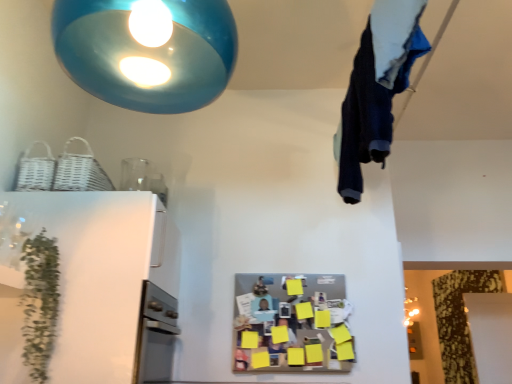
Question: Is white glossy refrigerator at left to the left of green leafy plant at left from the viewer's perspective?

Choices:
 (A) no
 (B) yes

Answer: (A)

Question: Is the surface of white glossy refrigerator at left in direct contact with green leafy plant at left?

Choices:
 (A) yes
 (B) no

Answer: (A)

Question: Would you consider white glossy refrigerator at left to be distant from green leafy plant at left?

Choices:
 (A) yes
 (B) no

Answer: (B)

Question: Is green leafy plant at left surrounded by white glossy refrigerator at left?

Choices:
 (A) yes
 (B) no

Answer: (B)

Question: From the image's perspective, is white glossy refrigerator at left located above green leafy plant at left?

Choices:
 (A) yes
 (B) no

Answer: (B)

Question: Considering the positions of point (29, 259) and point (166, 322), is point (29, 259) closer or farther from the camera than point (166, 322)?

Choices:
 (A) closer
 (B) farther

Answer: (A)

Question: Would you say green leafy plant at left is to the left or to the right of white glossy refrigerator at left in the picture?

Choices:
 (A) right
 (B) left

Answer: (B)

Question: Considering their positions, is green leafy plant at left located in front of or behind white glossy refrigerator at left?

Choices:
 (A) front
 (B) behind

Answer: (A)

Question: Which is correct: green leafy plant at left is inside white glossy refrigerator at left, or outside of it?

Choices:
 (A) inside
 (B) outside

Answer: (B)

Question: From the image's perspective, relative to green leafy plant at left, is white glossy refrigerator at left above or below?

Choices:
 (A) below
 (B) above

Answer: (A)

Question: Looking at their shapes, would you say white glossy refrigerator at left is wider or thinner than green leafy plant at left?

Choices:
 (A) wide
 (B) thin

Answer: (A)

Question: Is white glossy refrigerator at left bigger or smaller than green leafy plant at left?

Choices:
 (A) small
 (B) big

Answer: (B)

Question: From a real-world perspective, is white glossy refrigerator at left positioned above or below green leafy plant at left?

Choices:
 (A) above
 (B) below

Answer: (A)

Question: Considering the relative positions of dark blue fabric at upper right and glossy blue pendant light at upper center in the image provided, is dark blue fabric at upper right to the left or to the right of glossy blue pendant light at upper center?

Choices:
 (A) right
 (B) left

Answer: (A)

Question: Is point (358, 99) positioned closer to the camera than point (178, 56)?

Choices:
 (A) farther
 (B) closer

Answer: (B)